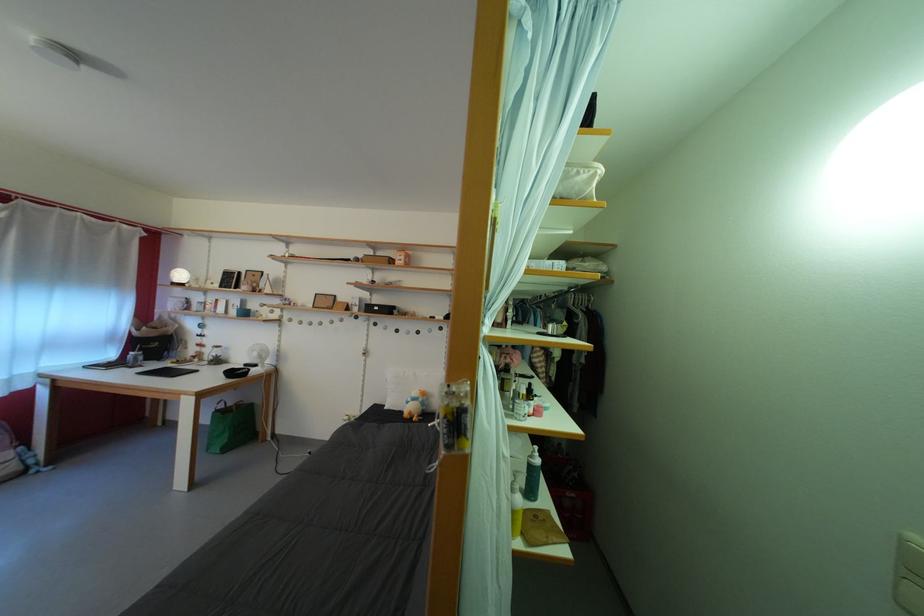
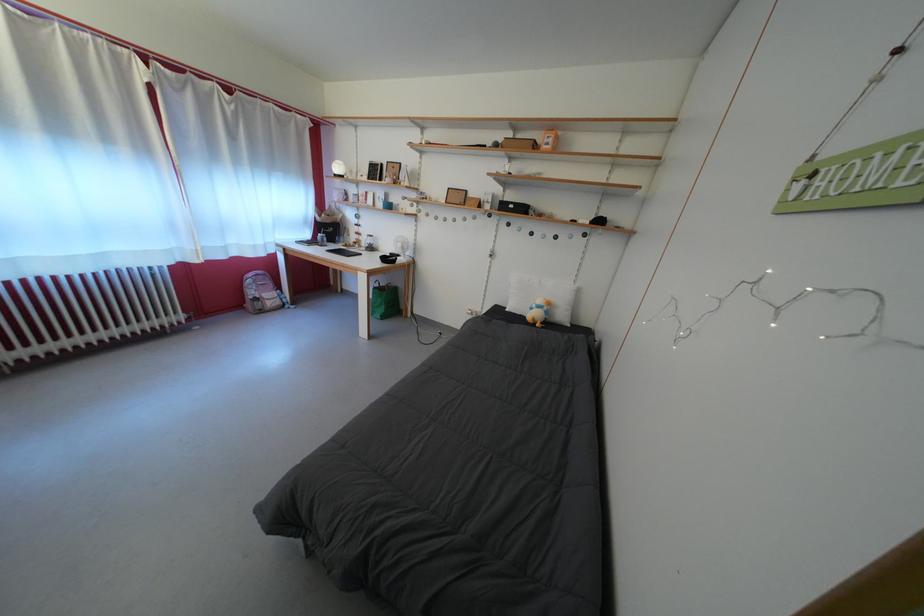
Locate, in the second image, the point that corresponds to the point at 384,314 in the first image.

(519, 213)